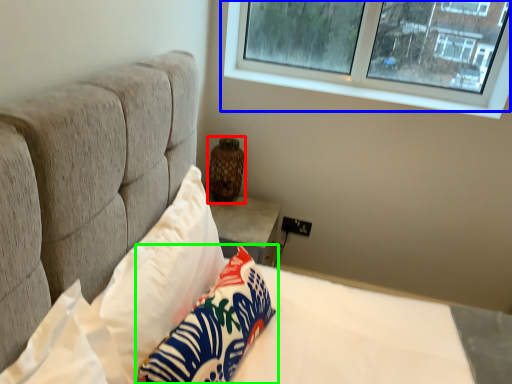
Question: Which is nearer to the vase (highlighted by a red box)? window (highlighted by a blue box) or pillow (highlighted by a green box).

Choices:
 (A) window
 (B) pillow

Answer: (A)